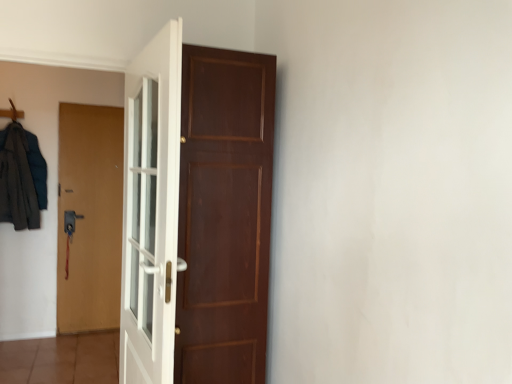
Consider the image. Measure the distance between point [181,34] and camera.

Point [181,34] is 1.51 meters from camera.

Identify the location of brown wooden door at center, the 2th door in the back-to-front sequence. (196, 213).

At what (x,y) coordinates should I click in order to perform the action: click on white glossy door at center, the 2th door in the left-to-right sequence. Please return your answer as a coordinate pair (x, y). The height and width of the screenshot is (384, 512). Looking at the image, I should click on (151, 209).

What do you see at coordinates (151, 209) in the screenshot? The height and width of the screenshot is (384, 512). I see `white glossy door at center, which appears as the first door when viewed from the front` at bounding box center [151, 209].

Locate an element on the screen. This screenshot has height=384, width=512. wooden hanger at upper left is located at coordinates (12, 112).

Between point (153, 374) and point (119, 204), which one is positioned behind?

The point (119, 204) is behind.

In the scene shown: Is white glossy door at center, arranged as the third door when viewed from the back, at the left side of brown matte door at left, acting as the 1th door starting from the left?

No.

Which object is further away from the camera taking this photo, white glossy door at center, which appears as the first door when viewed from the front, or brown matte door at left, which is the 1th door from back to front?

brown matte door at left, which is the 1th door from back to front, is further from the camera.

Would you say white glossy door at center, which ranks as the 2th door in right-to-left order, is inside or outside brown matte door at left, which is the third door from front to back?

white glossy door at center, which ranks as the 2th door in right-to-left order, cannot be found inside brown matte door at left, which is the third door from front to back.

Considering their positions, is dark gray fabric coat at left located in front of or behind white glossy door at center, the 2th door in the left-to-right sequence?

Visually, dark gray fabric coat at left is located behind white glossy door at center, the 2th door in the left-to-right sequence.

Is dark gray fabric coat at left wider or thinner than white glossy door at center, the 2th door in the left-to-right sequence?

Clearly, dark gray fabric coat at left has more width compared to white glossy door at center, the 2th door in the left-to-right sequence.

In the scene shown: Is dark gray fabric coat at left aimed at white glossy door at center, which ranks as the 2th door in right-to-left order?

No, dark gray fabric coat at left is not oriented towards white glossy door at center, which ranks as the 2th door in right-to-left order.

Is dark gray fabric coat at left not within white glossy door at center, which ranks as the 2th door in right-to-left order?

dark gray fabric coat at left is positioned outside white glossy door at center, which ranks as the 2th door in right-to-left order.

Consider the image. How distant is brown matte door at left, which is the 1th door from back to front, from wooden hanger at upper left?

The distance of brown matte door at left, which is the 1th door from back to front, from wooden hanger at upper left is 3.44 feet.

How different are the orientations of brown matte door at left, acting as the third door starting from the right, and wooden hanger at upper left in degrees?

They differ by 0.000515 degrees in their facing directions.

Is brown matte door at left, which is the 1th door from back to front, facing away from wooden hanger at upper left?

No.

Is brown matte door at left, which is the third door from front to back, surrounding wooden hanger at upper left?

No, wooden hanger at upper left is not inside brown matte door at left, which is the third door from front to back.

This screenshot has height=384, width=512. In order to click on door that is the 1st one above the brown matte door at left, which is the 1th door from back to front (from a real-world perspective) in this screenshot , I will do `click(196, 213)`.

How far apart are brown wooden door at center, the 2th door viewed from the front, and brown matte door at left, which is the third door from front to back?

They are 2.12 meters apart.

From the image's perspective, who appears lower, brown wooden door at center, arranged as the first door when viewed from the right, or brown matte door at left, acting as the third door starting from the right?

brown matte door at left, acting as the third door starting from the right, appears lower in the image.

Based on the photo, considering the sizes of brown wooden door at center, the 2th door viewed from the front, and brown matte door at left, acting as the third door starting from the right, in the image, is brown wooden door at center, the 2th door viewed from the front, wider or thinner than brown matte door at left, acting as the third door starting from the right,?

In the image, brown wooden door at center, the 2th door viewed from the front, appears to be wider than brown matte door at left, acting as the third door starting from the right.

Could you tell me if dark gray fabric coat at left is facing brown matte door at left, which is the 1th door from back to front?

No, dark gray fabric coat at left is not facing towards brown matte door at left, which is the 1th door from back to front.

Does dark gray fabric coat at left lie in front of brown matte door at left, which is the third door from front to back?

Yes, it is in front of brown matte door at left, which is the third door from front to back.

From the image's perspective, is dark gray fabric coat at left located above brown matte door at left, acting as the 1th door starting from the left?

Yes, from the image's perspective, dark gray fabric coat at left is above brown matte door at left, acting as the 1th door starting from the left.

Which is closer to the camera, [38,220] or [73,124]?

Point [38,220]

Considering the sizes of wooden hanger at upper left and brown matte door at left, which is the third door from front to back, in the image, is wooden hanger at upper left bigger or smaller than brown matte door at left, which is the third door from front to back,?

Clearly, wooden hanger at upper left is smaller in size than brown matte door at left, which is the third door from front to back.

Is the depth of wooden hanger at upper left less than that of brown matte door at left, acting as the third door starting from the right?

Yes, wooden hanger at upper left is closer to the viewer.

Is wooden hanger at upper left oriented towards brown matte door at left, which is the third door from front to back?

No, wooden hanger at upper left does not turn towards brown matte door at left, which is the third door from front to back.

Visually, is wooden hanger at upper left positioned to the left or to the right of brown matte door at left, which is the 1th door from back to front?

Based on their positions, wooden hanger at upper left is located to the left of brown matte door at left, which is the 1th door from back to front.

Does point (5, 115) lie behind point (183, 243)?

Yes, it is.

Which object is positioned more to the right, wooden hanger at upper left or brown wooden door at center, arranged as the first door when viewed from the right?

brown wooden door at center, arranged as the first door when viewed from the right, is more to the right.

From a real-world perspective, is wooden hanger at upper left positioned above or below brown wooden door at center, arranged as the first door when viewed from the right?

From a real-world perspective, wooden hanger at upper left is physically above brown wooden door at center, arranged as the first door when viewed from the right.

Looking at this image, can brown wooden door at center, the 2th door in the back-to-front sequence, be found inside wooden hanger at upper left?

Definitely not — brown wooden door at center, the 2th door in the back-to-front sequence, is not inside wooden hanger at upper left.

Find the location of a particular element. the 2nd door behind when counting from the white glossy door at center, which appears as the first door when viewed from the front is located at coordinates (89, 217).

From the dark gray fabric coat at left, count 2nd door to the right and point to it. Please provide its 2D coordinates.

[(151, 209)]

Looking at this image, based on their spatial positions, is brown matte door at left, which is the 1th door from back to front, or brown wooden door at center, the 2th door viewed from the front, further from wooden hanger at upper left?

brown wooden door at center, the 2th door viewed from the front, lies further to wooden hanger at upper left than the other object.

Based on their spatial positions, is brown matte door at left, acting as the third door starting from the right, or white glossy door at center, the 2th door in the left-to-right sequence, further from dark gray fabric coat at left?

white glossy door at center, the 2th door in the left-to-right sequence.

Estimate the real-world distances between objects in this image. Which object is closer to white glossy door at center, arranged as the third door when viewed from the back, brown matte door at left, acting as the third door starting from the right, or dark gray fabric coat at left?

Based on the image, brown matte door at left, acting as the third door starting from the right, appears to be nearer to white glossy door at center, arranged as the third door when viewed from the back.

When comparing their distances from brown matte door at left, which is the 1th door from back to front, does brown wooden door at center, the 2th door in the back-to-front sequence, or white glossy door at center, arranged as the third door when viewed from the back, seem further?

Among the two, brown wooden door at center, the 2th door in the back-to-front sequence, is located further to brown matte door at left, which is the 1th door from back to front.

Looking at the image, which one is located further to wooden hanger at upper left, brown wooden door at center, arranged as the first door when viewed from the right, or white glossy door at center, which ranks as the 2th door in right-to-left order?

brown wooden door at center, arranged as the first door when viewed from the right, is further to wooden hanger at upper left.

Considering their positions, is white glossy door at center, the 2th door in the left-to-right sequence, positioned further to dark gray fabric coat at left than brown matte door at left, acting as the third door starting from the right?

Based on the image, white glossy door at center, the 2th door in the left-to-right sequence, appears to be further to dark gray fabric coat at left.

From the image, which object appears to be nearer to white glossy door at center, the 2th door in the left-to-right sequence, brown wooden door at center, marked as the third door in a left-to-right arrangement, or wooden hanger at upper left?

brown wooden door at center, marked as the third door in a left-to-right arrangement, lies closer to white glossy door at center, the 2th door in the left-to-right sequence, than the other object.

When comparing their distances from brown wooden door at center, the 2th door viewed from the front, does brown matte door at left, which is the third door from front to back, or wooden hanger at upper left seem further?

wooden hanger at upper left.

Find the location of a particular element. door located between white glossy door at center, which ranks as the 2th door in right-to-left order, and wooden hanger at upper left in the depth direction is located at coordinates (196, 213).

Locate an element on the screen. Image resolution: width=512 pixels, height=384 pixels. clothing positioned between white glossy door at center, arranged as the third door when viewed from the back, and brown matte door at left, which is the third door from front to back, from near to far is located at coordinates click(17, 181).

Locate an element on the screen. The width and height of the screenshot is (512, 384). door located between white glossy door at center, which appears as the first door when viewed from the front, and brown matte door at left, which is the third door from front to back, in the depth direction is located at coordinates [196, 213].

Where is `hanger between white glossy door at center, which ranks as the 2th door in right-to-left order, and brown matte door at left, acting as the third door starting from the right, along the z-axis`? hanger between white glossy door at center, which ranks as the 2th door in right-to-left order, and brown matte door at left, acting as the third door starting from the right, along the z-axis is located at coordinates (12, 112).